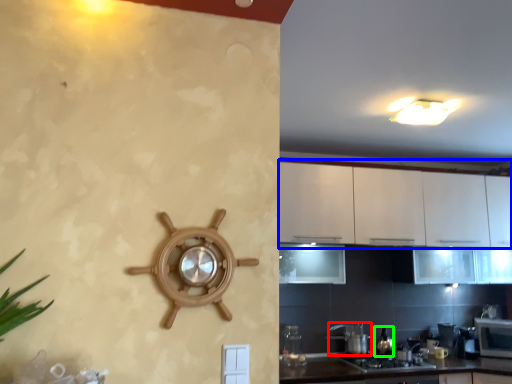
Question: Which object is positioned farthest from appliance (highlighted by a red box)? Select from cabinetry (highlighted by a blue box) and appliance (highlighted by a green box).

Choices:
 (A) cabinetry
 (B) appliance

Answer: (A)